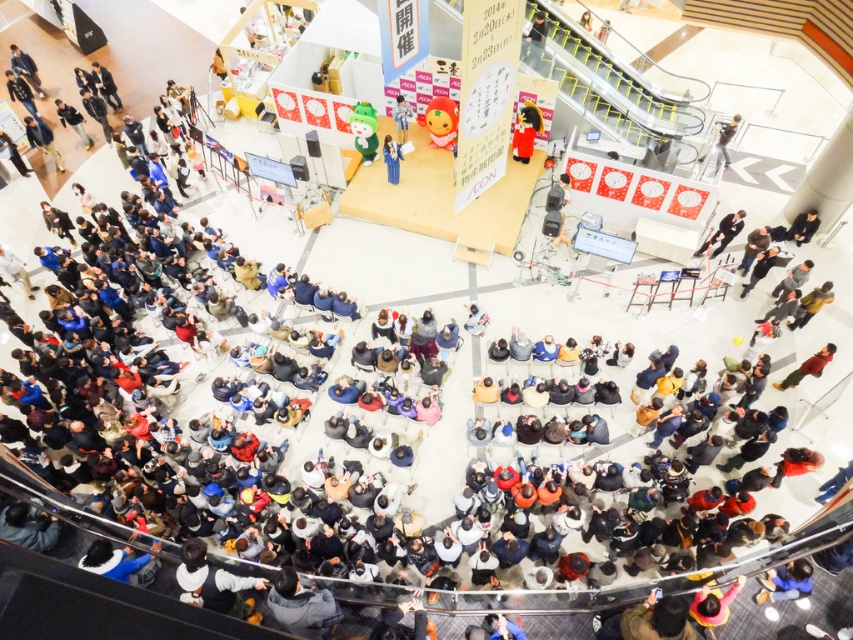
You are organizing a photo shoot and need to place a matte red plush toy at center and a light brown leather jacket at lower right. Given their sizes, which object will occupy more space in the frame?

The matte red plush toy at center is larger in size than the light brown leather jacket at lower right, so it will occupy more space in the frame.

You are standing at the viewpoint of this image and want to reach point (396, 170). Given that your average walking speed is 3 feet per second, how many seconds will it take you to walk to that point?

The distance between you and point (396, 170) is 52.21 feet. At a walking speed of 3 feet per second, it would take approximately 17.4 seconds to reach the point.